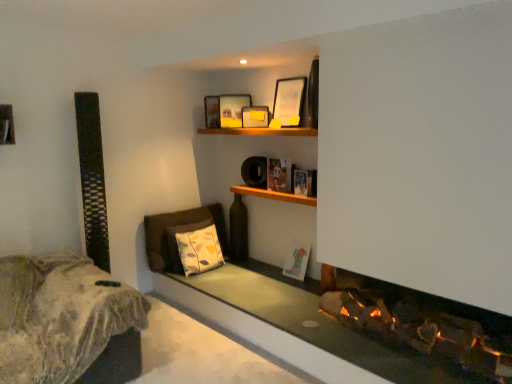
Identify the location of fuzzy fabric bed at lower left. The width and height of the screenshot is (512, 384). (60, 317).

What do you see at coordinates (60, 317) in the screenshot? I see `fuzzy fabric bed at lower left` at bounding box center [60, 317].

The image size is (512, 384). What do you see at coordinates (297, 260) in the screenshot?
I see `matte white picture frame at lower center, the 1th picture frame when ordered from bottom to top` at bounding box center [297, 260].

This screenshot has height=384, width=512. What do you see at coordinates (255, 117) in the screenshot? I see `yellow matte picture frame at upper center, which is the third picture frame from top to bottom` at bounding box center [255, 117].

Describe the element at coordinates (199, 248) in the screenshot. I see `yellow-patterned fabric pillow at lower center` at that location.

In order to face matte wooden picture frame at upper center, the 3th picture frame positioned from the bottom, should I rotate leftwards or rightwards?

It's best to rotate left around 2.813 degrees.

Find the location of a particular element. Image resolution: width=512 pixels, height=384 pixels. matte wooden picture frame at upper center, the 3th picture frame positioned from the bottom is located at coordinates (232, 109).

Locate an element on the screen. fuzzy fabric bed at lower left is located at coordinates (60, 317).

From a real-world perspective, is yellow-patterned fabric pillow at lower center positioned over yellow matte picture frame at upper center, which is the second picture frame in bottom-to-top order, based on gravity?

No, from a real-world perspective, yellow-patterned fabric pillow at lower center is not above yellow matte picture frame at upper center, which is the second picture frame in bottom-to-top order.

Which is closer, (x=179, y=255) or (x=264, y=123)?

Point (x=264, y=123)

Considering the positions of objects yellow-patterned fabric pillow at lower center and yellow matte picture frame at upper center, which is the second picture frame in bottom-to-top order, in the image provided, who is behind, yellow-patterned fabric pillow at lower center or yellow matte picture frame at upper center, which is the second picture frame in bottom-to-top order,?

yellow matte picture frame at upper center, which is the second picture frame in bottom-to-top order, is further away from the camera.

Is point (63, 285) farther from viewer compared to point (214, 244)?

No, (63, 285) is closer to viewer.

Is fuzzy fabric bed at lower left positioned before yellow-patterned fabric pillow at lower center?

Yes.

Is fuzzy fabric bed at lower left bigger or smaller than yellow-patterned fabric pillow at lower center?

In the image, fuzzy fabric bed at lower left appears to be larger than yellow-patterned fabric pillow at lower center.

In the scene shown: From the image's perspective, between fuzzy fabric bed at lower left and yellow-patterned fabric pillow at lower center, who is located below?

fuzzy fabric bed at lower left is shown below in the image.

Is matte wooden picture frame at upper center, the 4th picture frame in the bottom-to-top sequence, far from matte paper book at center?

No, there isn't a large distance between matte wooden picture frame at upper center, the 4th picture frame in the bottom-to-top sequence, and matte paper book at center.

From the image's perspective, starting from the matte paper book at center, which picture frame is the 3rd one above? Please provide its 2D coordinates.

[(289, 101)]

In the image, is matte wooden picture frame at upper center, the 4th picture frame in the bottom-to-top sequence, on the left side or the right side of matte paper book at center?

In the image, matte wooden picture frame at upper center, the 4th picture frame in the bottom-to-top sequence, appears on the right side of matte paper book at center.

Is yellow-patterned fabric pillow at lower center not close to wooden shelf at upper center?

Yes.

Is yellow-patterned fabric pillow at lower center not within wooden shelf at upper center?

Indeed, yellow-patterned fabric pillow at lower center is completely outside wooden shelf at upper center.

Is yellow-patterned fabric pillow at lower center oriented towards wooden shelf at upper center?

No, yellow-patterned fabric pillow at lower center is not turned towards wooden shelf at upper center.

Does yellow-patterned fabric pillow at lower center have a lesser height compared to wooden shelf at upper center?

Incorrect, the height of yellow-patterned fabric pillow at lower center does not fall short of that of wooden shelf at upper center.

Considering the sizes of objects fuzzy fabric bed at lower left and matte wooden picture frame at upper center, the 3th picture frame positioned from the bottom, in the image provided, who is smaller, fuzzy fabric bed at lower left or matte wooden picture frame at upper center, the 3th picture frame positioned from the bottom,?

Smaller between the two is matte wooden picture frame at upper center, the 3th picture frame positioned from the bottom.

Do you think fuzzy fabric bed at lower left is within matte wooden picture frame at upper center, the 3th picture frame positioned from the bottom, or outside of it?

fuzzy fabric bed at lower left is spatially situated outside matte wooden picture frame at upper center, the 3th picture frame positioned from the bottom.

Which of these two, fuzzy fabric bed at lower left or matte wooden picture frame at upper center, the 3th picture frame positioned from the bottom, is thinner?

Thinner between the two is matte wooden picture frame at upper center, the 3th picture frame positioned from the bottom.

From the image's perspective, who appears lower, fuzzy fabric bed at lower left or matte wooden picture frame at upper center, the 3th picture frame positioned from the bottom?

fuzzy fabric bed at lower left is shown below in the image.

Is matte wooden picture frame at upper center, which is the first picture frame in top-to-bottom order, positioned beyond the bounds of matte white picture frame at lower center, which is counted as the fourth picture frame, starting from the top?

That's correct, matte wooden picture frame at upper center, which is the first picture frame in top-to-bottom order, is outside of matte white picture frame at lower center, which is counted as the fourth picture frame, starting from the top.

Is matte wooden picture frame at upper center, which is the first picture frame in top-to-bottom order, wider or thinner than matte white picture frame at lower center, which is counted as the fourth picture frame, starting from the top?

Considering their sizes, matte wooden picture frame at upper center, which is the first picture frame in top-to-bottom order, looks slimmer than matte white picture frame at lower center, which is counted as the fourth picture frame, starting from the top.

Is point (300, 109) positioned before point (296, 247)?

That is True.

Does wooden shelf at upper center appear on the right side of matte white picture frame at lower center, the 1th picture frame when ordered from bottom to top?

Incorrect, wooden shelf at upper center is not on the right side of matte white picture frame at lower center, the 1th picture frame when ordered from bottom to top.

Which object is closer to the camera, wooden shelf at upper center or matte white picture frame at lower center, the 1th picture frame when ordered from bottom to top?

wooden shelf at upper center is in front.

Measure the distance from wooden shelf at upper center to matte white picture frame at lower center, the 1th picture frame when ordered from bottom to top.

wooden shelf at upper center is 3.64 feet away from matte white picture frame at lower center, the 1th picture frame when ordered from bottom to top.

Which object is thinner, wooden shelf at upper center or matte white picture frame at lower center, the 1th picture frame when ordered from bottom to top?

With smaller width is matte white picture frame at lower center, the 1th picture frame when ordered from bottom to top.

The width and height of the screenshot is (512, 384). In order to click on pillow in front of the yellow matte picture frame at upper center, which is the third picture frame from top to bottom in this screenshot , I will do point(199,248).

Identify the location of furniture on the left side of yellow-patterned fabric pillow at lower center. (60, 317).

In the scene shown: When comparing their distances from matte wooden picture frame at upper center, which is the first picture frame in top-to-bottom order, does wooden shelf at upper center or yellow matte picture frame at upper center, which is the third picture frame from top to bottom, seem further?

Based on the image, yellow matte picture frame at upper center, which is the third picture frame from top to bottom, appears to be further to matte wooden picture frame at upper center, which is the first picture frame in top-to-bottom order.

Considering their positions, is wooden shelf at center positioned closer to matte paper book at center than matte white picture frame at lower center, which is counted as the fourth picture frame, starting from the top?

wooden shelf at center is closer to matte paper book at center.

Considering their positions, is wooden shelf at center positioned further to yellow-patterned fabric pillow at lower center than wooden shelf at upper center?

wooden shelf at upper center lies further to yellow-patterned fabric pillow at lower center than the other object.

Looking at this image, considering their positions, is fuzzy fabric bed at lower left positioned closer to matte wooden picture frame at upper center, acting as the 2th picture frame starting from the top, than wooden shelf at center?

wooden shelf at center.

Based on their spatial positions, is matte paper book at center or wooden shelf at upper center closer to matte wooden picture frame at upper center, which is the first picture frame in top-to-bottom order?

wooden shelf at upper center lies closer to matte wooden picture frame at upper center, which is the first picture frame in top-to-bottom order, than the other object.

Looking at the image, which one is located further to fuzzy fabric bed at lower left, matte wooden picture frame at upper center, the 3th picture frame positioned from the bottom, or wooden shelf at center?

Based on the image, matte wooden picture frame at upper center, the 3th picture frame positioned from the bottom, appears to be further to fuzzy fabric bed at lower left.

When comparing their distances from matte wooden picture frame at upper center, the 4th picture frame in the bottom-to-top sequence, does fuzzy fabric bed at lower left or yellow matte picture frame at upper center, which is the second picture frame in bottom-to-top order, seem closer?

yellow matte picture frame at upper center, which is the second picture frame in bottom-to-top order, is closer to matte wooden picture frame at upper center, the 4th picture frame in the bottom-to-top sequence.

Looking at the image, which one is located further to wooden shelf at upper center, matte wooden picture frame at upper center, the 3th picture frame positioned from the bottom, or matte paper book at center?

matte paper book at center is positioned further to the anchor wooden shelf at upper center.

This screenshot has height=384, width=512. Find the location of `cabinet located between fuzzy fabric bed at lower left and yellow matte picture frame at upper center, which is the third picture frame from top to bottom, in the depth direction`. cabinet located between fuzzy fabric bed at lower left and yellow matte picture frame at upper center, which is the third picture frame from top to bottom, in the depth direction is located at coordinates (x=274, y=195).

Locate an element on the screen. Image resolution: width=512 pixels, height=384 pixels. cabinet between yellow-patterned fabric pillow at lower center and matte white picture frame at lower center, the 1th picture frame when ordered from bottom to top is located at coordinates (274, 195).

Image resolution: width=512 pixels, height=384 pixels. In order to click on cabinet that lies between wooden shelf at upper center and yellow-patterned fabric pillow at lower center from top to bottom in this screenshot , I will do `click(274, 195)`.

The width and height of the screenshot is (512, 384). Find the location of `shelf between fuzzy fabric bed at lower left and matte wooden picture frame at upper center, which is the first picture frame in top-to-bottom order`. shelf between fuzzy fabric bed at lower left and matte wooden picture frame at upper center, which is the first picture frame in top-to-bottom order is located at coordinates (261, 131).